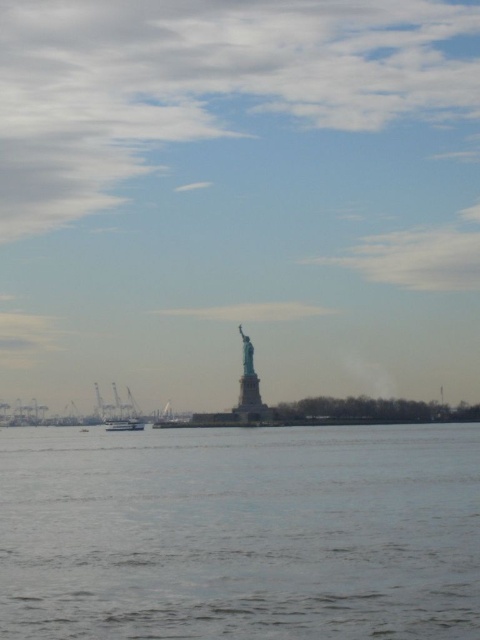
Question: In this image, where is polished copper statue at center located relative to white plastic boat at center?

Choices:
 (A) above
 (B) below

Answer: (A)

Question: Which point is farther from the camera taking this photo?

Choices:
 (A) (116, 422)
 (B) (106, 420)
 (C) (251, 346)

Answer: (B)

Question: Which of the following is the closest to the observer?

Choices:
 (A) (128, 412)
 (B) (128, 422)
 (C) (252, 368)
 (D) (288, 520)

Answer: (D)

Question: Which point is farther to the camera?

Choices:
 (A) white glossy boat at lower left
 (B) polished copper statue at center

Answer: (B)

Question: Does clear water at center have a smaller size compared to white glossy boat at lower left?

Choices:
 (A) yes
 (B) no

Answer: (B)

Question: Is the position of white glossy boat at lower left less distant than that of polished copper statue at center?

Choices:
 (A) no
 (B) yes

Answer: (B)